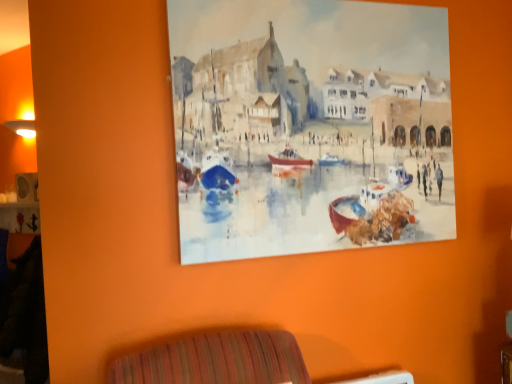
Describe the element at coordinates (20, 217) in the screenshot. I see `wooden table at lower left` at that location.

Measure the distance between point (1, 213) and camera.

The depth of point (1, 213) is 9.78 feet.

Find the location of a particular element. wooden table at lower left is located at coordinates tap(20, 217).

This screenshot has width=512, height=384. Identify the location of wooden table at lower left. (20, 217).